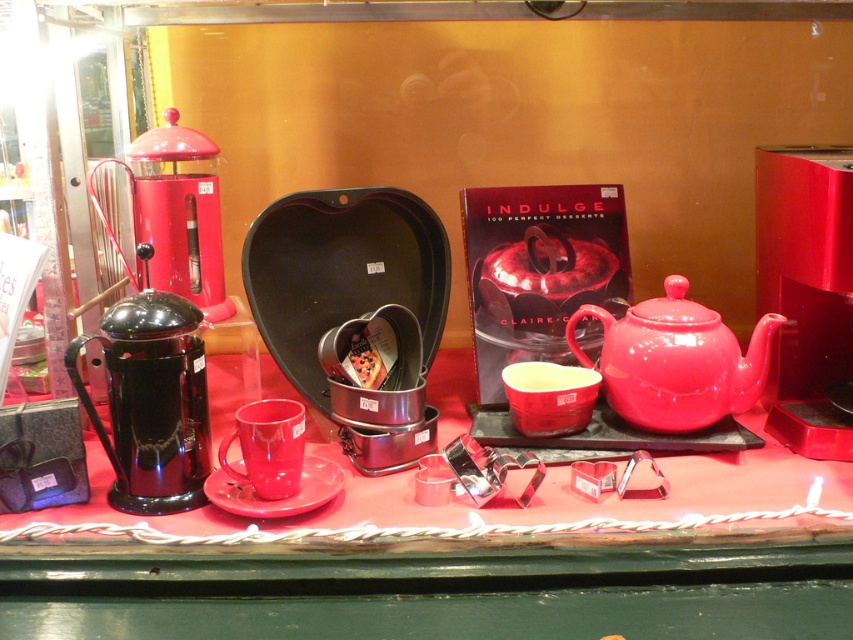
You are standing in front of a Valentine display. There are two points marked on the display. The first point is at coordinate point (107, 435) and the second point is at coordinate point (195, 304). Which point is closer to you?

Point (107, 435) is closer to the viewer than point (195, 304).

You are arranging a Valentine gift set on a table. The glossy ceramic table at center has a red lantern and a black French press placed on it. If you want to place a small red cup on the table without overlapping any existing items, where should you position it?

The glossy ceramic table at center is located at point (437, 586), so you should place the small red cup on an area of the table that is not occupied by the red lantern or the black French press, ensuring it does not overlap with their positions.